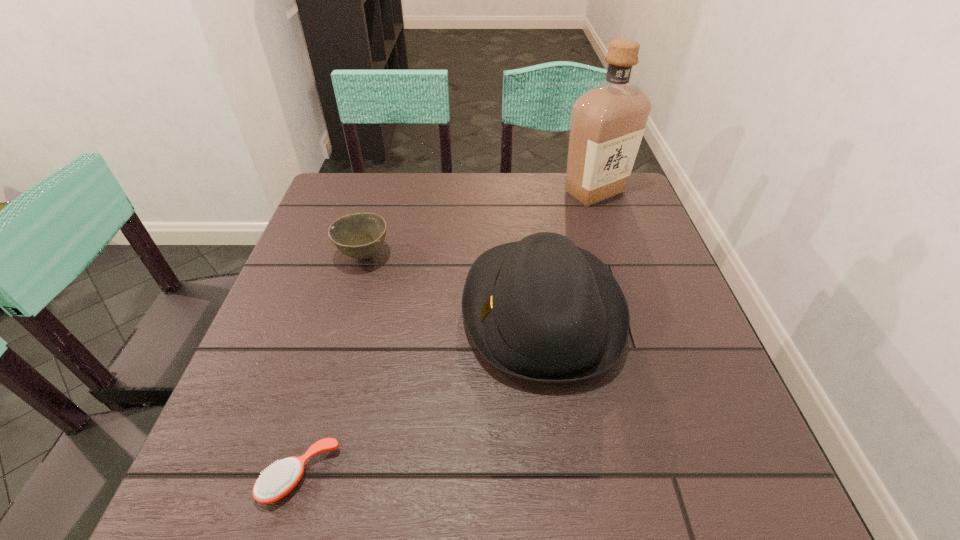
At what (x,y) coordinates should I click in order to perform the action: click on vacant space at the far edge. Please return your answer as a coordinate pair (x, y). Looking at the image, I should click on (442, 192).

In order to click on free region at the near edge in this screenshot , I will do `click(378, 452)`.

Identify the location of vacant region at the left edge of the desktop. The image size is (960, 540). (350, 287).

Image resolution: width=960 pixels, height=540 pixels. Find the location of `vacant area at the right edge`. vacant area at the right edge is located at coordinates (619, 238).

In the image, there is a desktop. Where is `vacant space at the far left corner`? The height and width of the screenshot is (540, 960). vacant space at the far left corner is located at coordinates (352, 200).

Where is `vacant space at the far right corner of the desktop`? This screenshot has height=540, width=960. vacant space at the far right corner of the desktop is located at coordinates (638, 215).

Where is `empty space that is in between the hairbrush and the farthest object`? The width and height of the screenshot is (960, 540). empty space that is in between the hairbrush and the farthest object is located at coordinates (447, 333).

Where is `vacant area that lies between the second shortest object and the farthest object`? The width and height of the screenshot is (960, 540). vacant area that lies between the second shortest object and the farthest object is located at coordinates (479, 224).

Image resolution: width=960 pixels, height=540 pixels. Find the location of `free space between the second tallest object and the nearest object`. free space between the second tallest object and the nearest object is located at coordinates (421, 393).

This screenshot has width=960, height=540. Find the location of `free spot between the fedora and the hairbrush`. free spot between the fedora and the hairbrush is located at coordinates (421, 393).